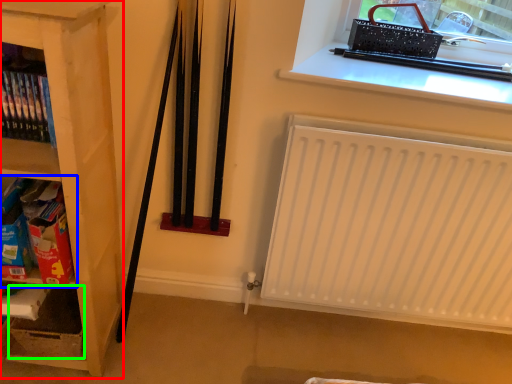
Question: Considering the real-world distances, which object is closest to shelf (highlighted by a red box)? shelf (highlighted by a blue box) or storage box (highlighted by a green box).

Choices:
 (A) shelf
 (B) storage box

Answer: (A)